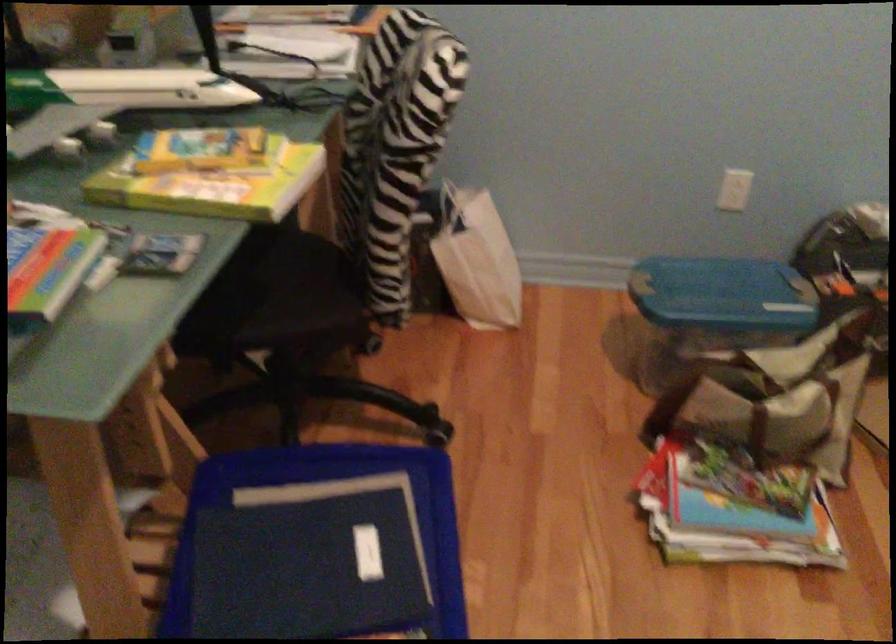
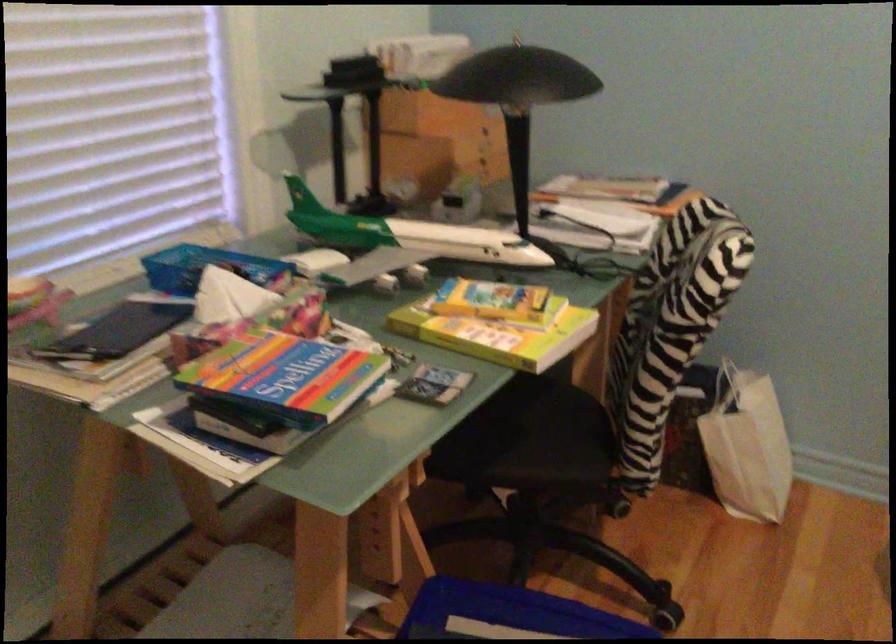
Find the pixel in the second image that matches (x=297, y=474) in the first image.

(507, 614)